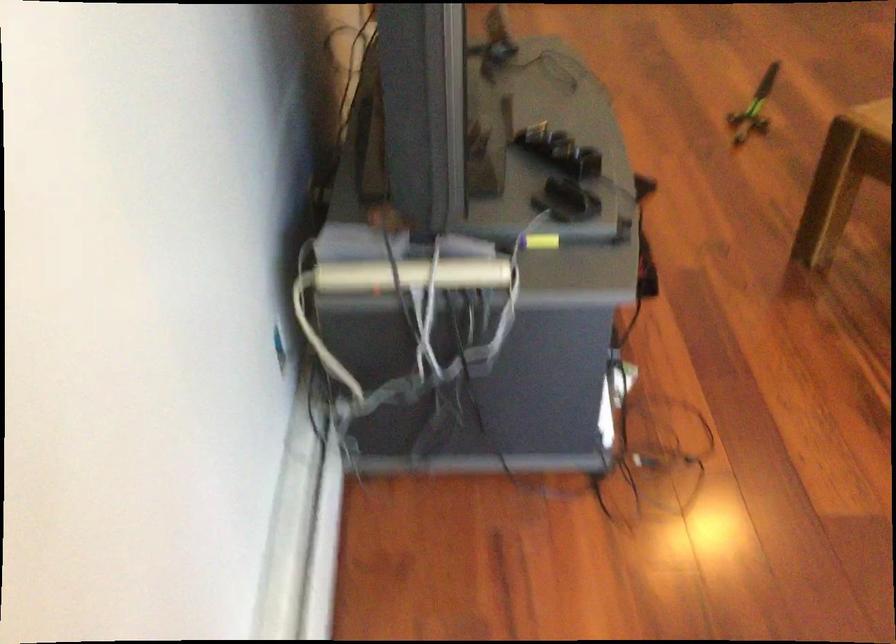
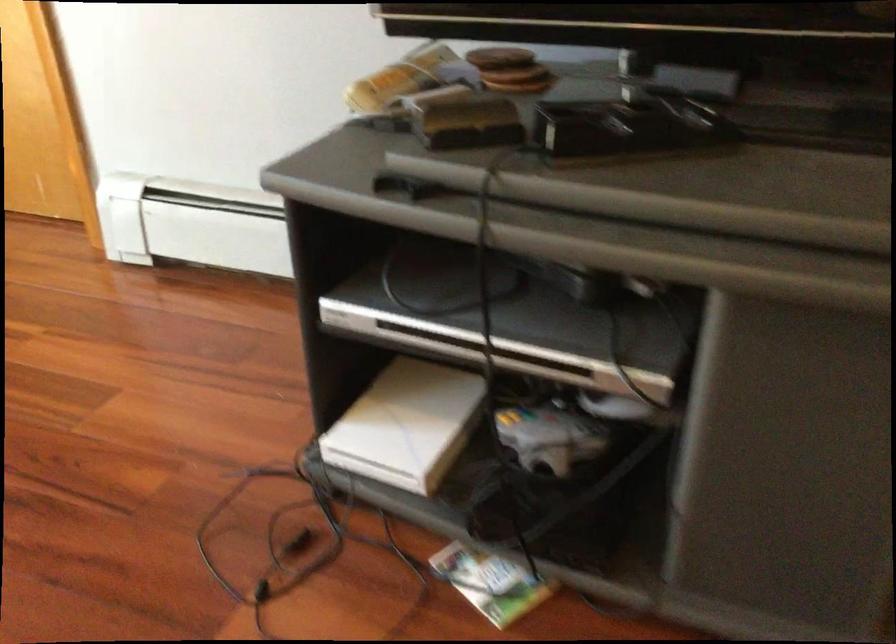
In the second image, find the point that corresponds to (576,381) in the first image.

(407, 424)